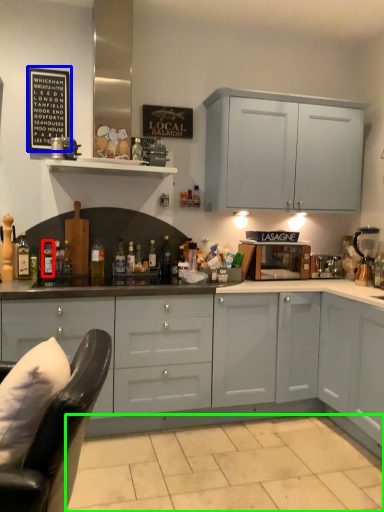
Question: Considering the real-world distances, which object is farthest from bottle (highlighted by a red box)? bulletin board (highlighted by a blue box) or tile (highlighted by a green box)?

Choices:
 (A) bulletin board
 (B) tile

Answer: (B)